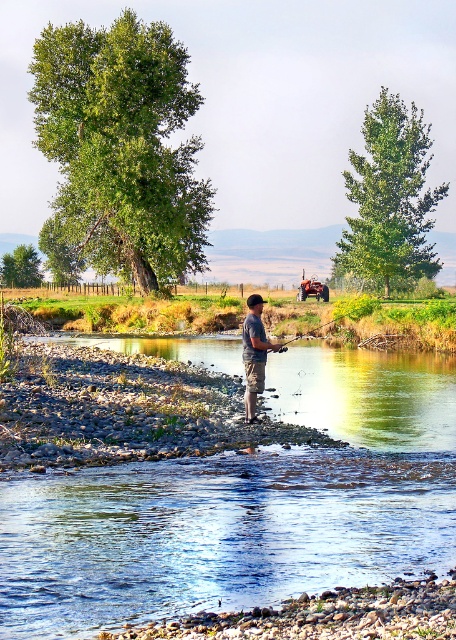
Can you confirm if light brown leather boots at center is positioned to the left of wooden fishing pole at center?

Indeed, light brown leather boots at center is positioned on the left side of wooden fishing pole at center.

From the picture: Is light brown leather boots at center smaller than wooden fishing pole at center?

Yes.

Between point (248, 381) and point (298, 339), which one is positioned behind?

Positioned behind is point (298, 339).

The width and height of the screenshot is (456, 640). I want to click on light brown leather boots at center, so click(254, 353).